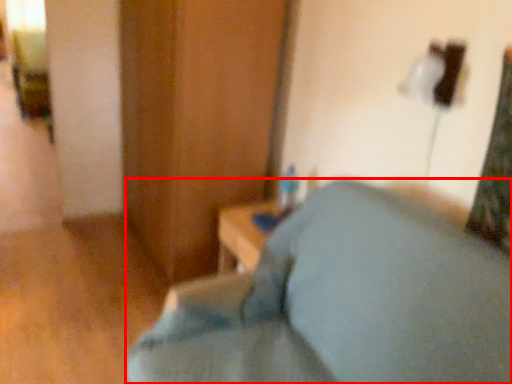
Question: From the image's perspective, where is furniture (annotated by the red box) located in relation to dresser in the image?

Choices:
 (A) below
 (B) above

Answer: (A)